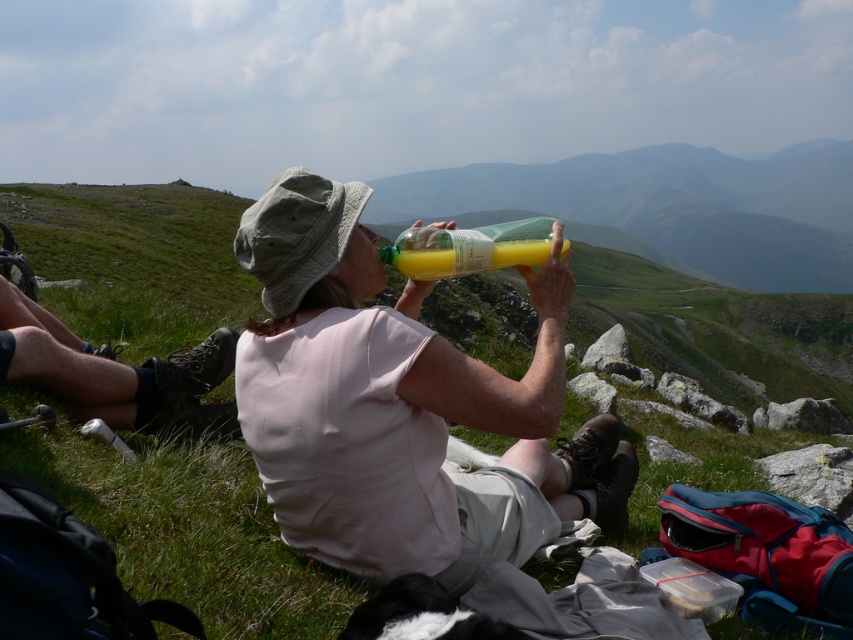
Question: Which point is farther to the camera?

Choices:
 (A) (526, 237)
 (B) (238, 243)
 (C) (281, 502)

Answer: (A)

Question: Is matte plastic bottle at center wider than khaki fabric hat at center?

Choices:
 (A) yes
 (B) no

Answer: (A)

Question: Is matte plastic bottle at center to the right of khaki fabric hat at center from the viewer's perspective?

Choices:
 (A) yes
 (B) no

Answer: (A)

Question: Which object is farther from the camera taking this photo?

Choices:
 (A) khaki fabric hat at center
 (B) matte plastic bottle at center

Answer: (A)

Question: Is khaki fabric hat at center to the left of translucent yellow liquid at upper center from the viewer's perspective?

Choices:
 (A) yes
 (B) no

Answer: (A)

Question: Which point is farther to the camera?

Choices:
 (A) matte plastic bottle at center
 (B) translucent yellow liquid at upper center
 (C) khaki fabric hat at center

Answer: (B)